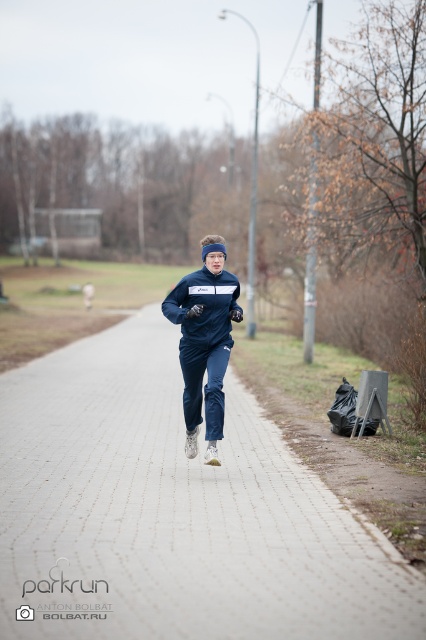
Does point (198, 369) lie behind point (204, 272)?

No, it is in front of (204, 272).

Between navy blue tracksuit at center and navy blue fleece sweatshirt at center, which one appears on the left side from the viewer's perspective?

navy blue tracksuit at center is more to the left.

Measure the distance between point (198,400) and camera.

They are 8.58 meters apart.

This screenshot has width=426, height=640. Identify the location of navy blue tracksuit at center. 204,340.

Can you confirm if gray brick pavement at center is taller than navy blue tracksuit at center?

In fact, gray brick pavement at center may be shorter than navy blue tracksuit at center.

Locate an element on the screen. gray brick pavement at center is located at coordinates (175, 513).

At what (x,y) coordinates should I click in order to perform the action: click on gray brick pavement at center. Please return your answer as a coordinate pair (x, y). The image size is (426, 640). Looking at the image, I should click on (175, 513).

Can you confirm if gray brick pavement at center is shorter than navy blue fleece sweatshirt at center?

No.

Where is `gray brick pavement at center`? gray brick pavement at center is located at coordinates (175, 513).